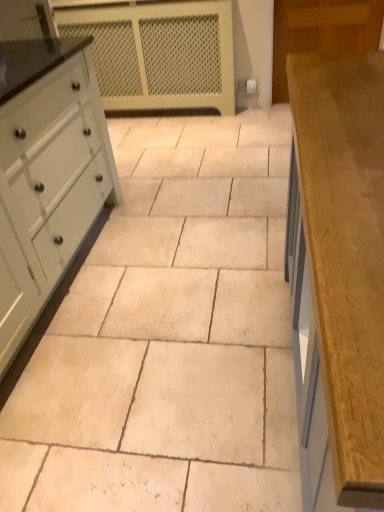
Where is `free location in front of white mesh radiator at upper center`? free location in front of white mesh radiator at upper center is located at coordinates (180, 156).